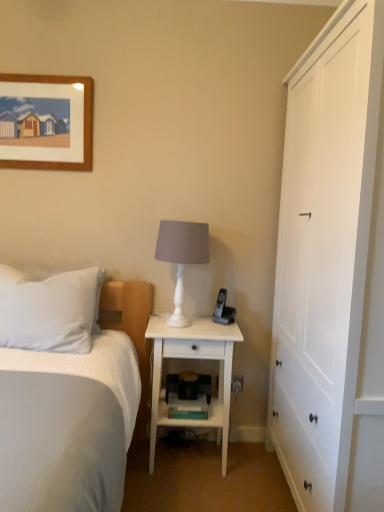
The height and width of the screenshot is (512, 384). Identify the location of vacant point above white wood nightstand at center (from a real-world perspective). (194, 326).